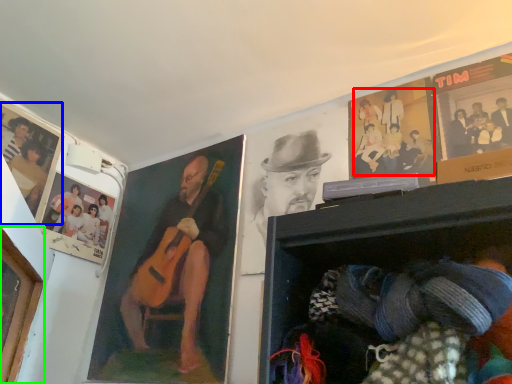
Question: Which is farther away from person (highlighted by a red box)? poster page (highlighted by a blue box) or portrait (highlighted by a green box)?

Choices:
 (A) poster page
 (B) portrait

Answer: (A)